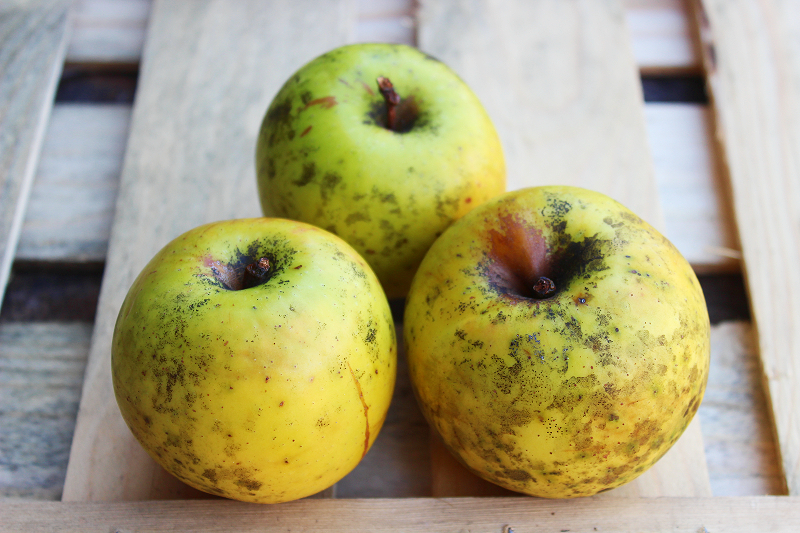
Identify the location of wooden board. This screenshot has height=533, width=800. (38, 43), (102, 28), (116, 143), (62, 359), (232, 82), (464, 25), (768, 91).